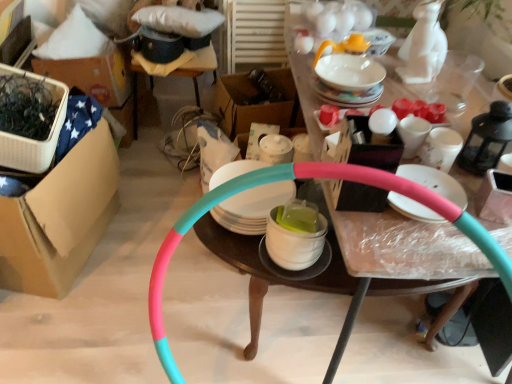
Question: Is white glossy mug at upper right, arranged as the 4th tableware when ordered from the bottom, oriented away from white glossy mug at center, the fifth tableware from the bottom?

Choices:
 (A) yes
 (B) no

Answer: (B)

Question: Can you confirm if white glossy mug at upper right, arranged as the 4th tableware when ordered from the bottom, is taller than white glossy mug at center, which appears as the 4th tableware when viewed from the top?

Choices:
 (A) yes
 (B) no

Answer: (B)

Question: Is white glossy mug at upper right, the fifth tableware positioned from the top, at the left side of white glossy mug at center, the fifth tableware from the bottom?

Choices:
 (A) yes
 (B) no

Answer: (B)

Question: Is white glossy mug at upper right, arranged as the 4th tableware when ordered from the bottom, not inside white glossy mug at center, which appears as the 4th tableware when viewed from the top?

Choices:
 (A) no
 (B) yes

Answer: (B)

Question: From a real-world perspective, is white glossy mug at upper right, arranged as the 4th tableware when ordered from the bottom, over white glossy mug at center, the fifth tableware from the bottom?

Choices:
 (A) yes
 (B) no

Answer: (A)

Question: From the image's perspective, is white glossy mug at upper right, the fifth tableware positioned from the top, beneath white glossy mug at center, which appears as the 4th tableware when viewed from the top?

Choices:
 (A) yes
 (B) no

Answer: (A)

Question: Is white glossy mug at center, the fifth tableware from the bottom, taller than white glossy plate at center, the 7th tableware when ordered from top to bottom?

Choices:
 (A) yes
 (B) no

Answer: (A)

Question: Is white glossy mug at center, which appears as the 4th tableware when viewed from the top, behind white glossy plate at center, the 7th tableware when ordered from top to bottom?

Choices:
 (A) no
 (B) yes

Answer: (B)

Question: From a real-world perspective, is white glossy mug at center, the fifth tableware from the bottom, located higher than white glossy plate at center, the 7th tableware when ordered from top to bottom?

Choices:
 (A) yes
 (B) no

Answer: (A)

Question: Does white glossy mug at center, which appears as the 4th tableware when viewed from the top, appear on the right side of white glossy plate at center, acting as the 2th tableware starting from the bottom?

Choices:
 (A) yes
 (B) no

Answer: (A)

Question: Is white glossy mug at center, the fifth tableware from the bottom, thinner than white glossy plate at center, the 7th tableware when ordered from top to bottom?

Choices:
 (A) no
 (B) yes

Answer: (B)

Question: Is white glossy mug at center, which appears as the 4th tableware when viewed from the top, shorter than white glossy plate at center, the 7th tableware when ordered from top to bottom?

Choices:
 (A) yes
 (B) no

Answer: (B)

Question: Is matte white plate at center, which ranks as the third tableware in bottom-to-top order, taller than white glossy mug at center, the fifth tableware from the bottom?

Choices:
 (A) yes
 (B) no

Answer: (B)